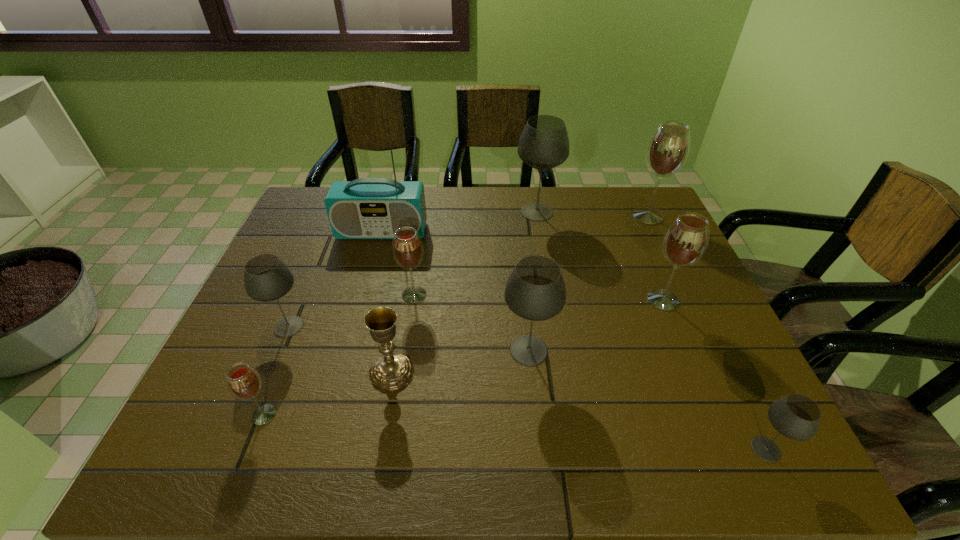
At what (x,y) coordinates should I click in order to perform the action: click on the third closest red wineglass to the third smallest red wineglass. Please return your answer as a coordinate pair (x, y). Looking at the image, I should click on (244, 383).

Point out which red wineglass is positioned as the fourth nearest to the second biggest gray wineglass. Please provide its 2D coordinates. Your answer should be formatted as a tuple, i.e. [(x, y)], where the tuple contains the x and y coordinates of a point satisfying the conditions above.

[(668, 149)]

What are the coordinates of `free space that satisfies the following two spatial constraints: 1. on the front side of the third smallest gray wineglass; 2. on the right side of the third biggest red wineglass` in the screenshot? It's located at (406, 350).

At what (x,y) coordinates should I click in order to perform the action: click on free space that satisfies the following two spatial constraints: 1. on the front panel of the radio receiver; 2. on the right side of the third smallest gray wineglass. Please return your answer as a coordinate pair (x, y). Looking at the image, I should click on (350, 350).

This screenshot has height=540, width=960. Identify the location of free point that satisfies the following two spatial constraints: 1. on the back side of the gold chalice; 2. on the left side of the farthest red wineglass. (419, 216).